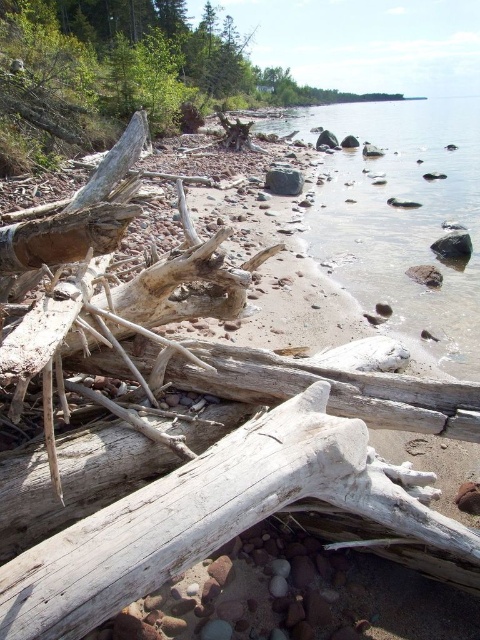
You are standing at the origin point in the coastal scene. You see two points marked as point 1 at coordinates point (417,148) and point 2 at coordinates point (282,173). Which point is closer to you?

Point 2 at coordinates point (282,173) is closer to you because point 1 is behind it according to the spatial description.

You are standing on the driftwood log in the foreground and want to reach the clear glass water at center. Which direction should you move to get there?

You should move towards the center of the image to reach the clear glass water at center, which is located at point coordinates of 0.336 on the x axis and 0.835 on the y axis.